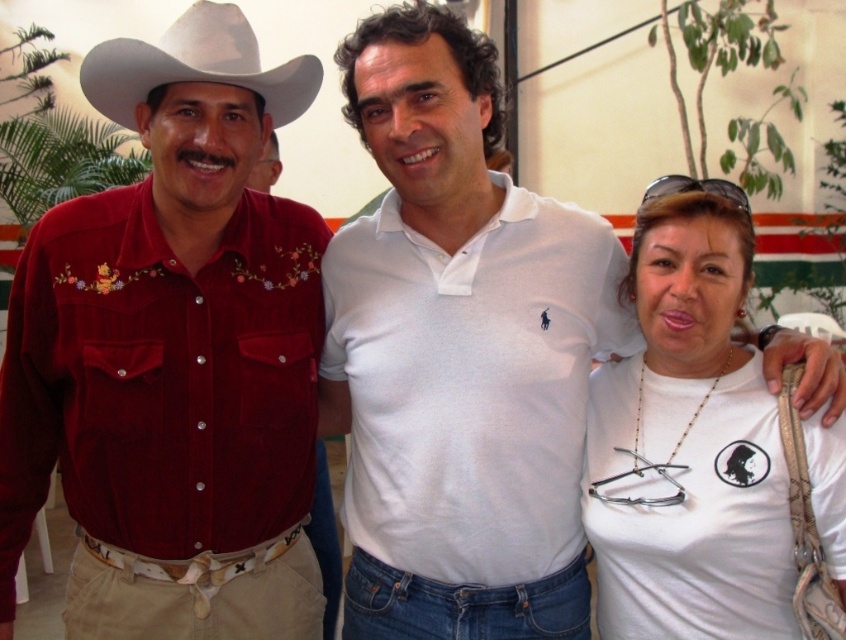
Can you confirm if velvet red shirt at center is positioned to the left of matte red shirt at left?

Indeed, velvet red shirt at center is positioned on the left side of matte red shirt at left.

Does point (81, 563) come farther from viewer compared to point (276, 145)?

No.

Between point (119, 604) and point (267, 164), which one is positioned behind?

The point (267, 164) is more distant.

The width and height of the screenshot is (846, 640). I want to click on velvet red shirt at center, so click(x=173, y=356).

Is point (663, 236) more distant than point (254, 166)?

No.

Can you confirm if white matte t-shirt at right is positioned to the right of matte red shirt at left?

Correct, you'll find white matte t-shirt at right to the right of matte red shirt at left.

Is point (735, 404) closer to camera compared to point (267, 154)?

Yes.

Identify the location of white matte t-shirt at right. Image resolution: width=846 pixels, height=640 pixels. (706, 451).

Can you confirm if white cotton polo shirt at center is wider than white felt cowboy hat at left?

Correct, the width of white cotton polo shirt at center exceeds that of white felt cowboy hat at left.

Between point (382, 484) and point (96, 99), which one is positioned in front?

Point (96, 99) is in front.

Is point (363, 385) positioned after point (229, 58)?

That is True.

In order to click on white cotton polo shirt at center in this screenshot , I will do `click(471, 384)`.